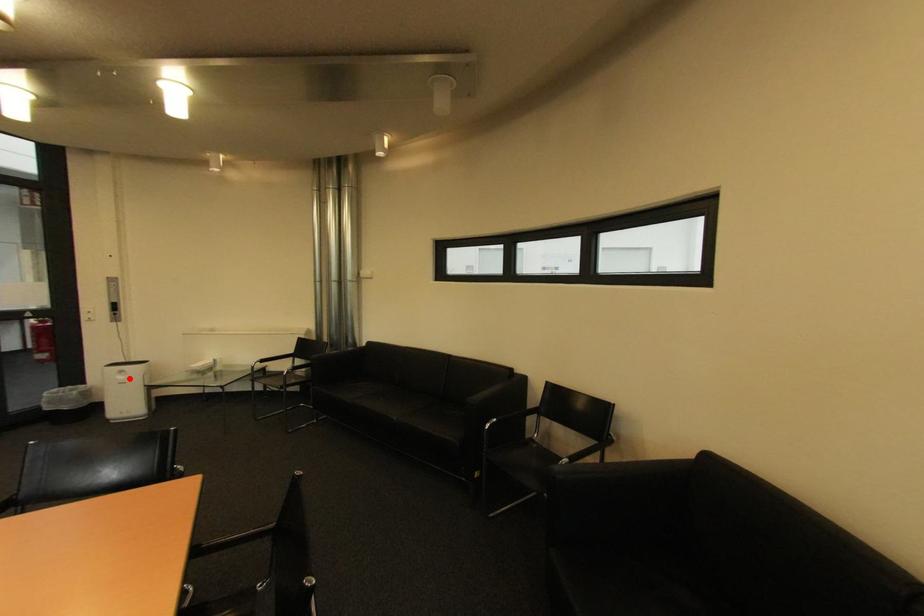
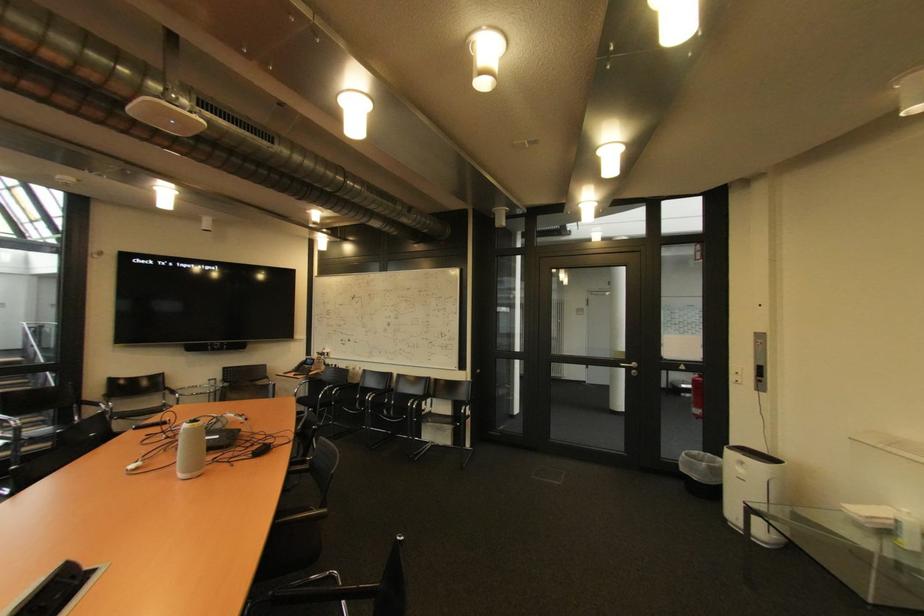
The point at the highlighted location is marked in the first image. Where is the corresponding point in the second image?

(748, 471)